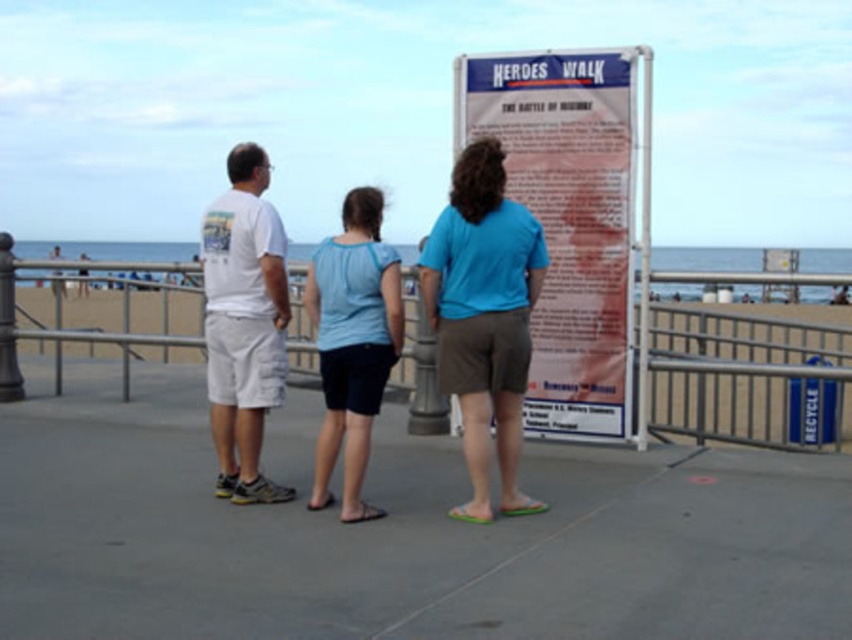
Does metallic gray railing at center appear on the right side of white cotton t-shirt at left?

No, metallic gray railing at center is not to the right of white cotton t-shirt at left.

Is metallic gray railing at center further to the viewer compared to white cotton t-shirt at left?

Yes.

Is point (153, 342) closer to viewer compared to point (251, 467)?

That is False.

Where is `metallic gray railing at center`? Image resolution: width=852 pixels, height=640 pixels. metallic gray railing at center is located at coordinates (747, 378).

Between point (593, 131) and point (338, 371), which one is positioned behind?

The point (593, 131) is behind.

Is point (619, 328) in front of point (505, 202)?

That is False.

Where is `white paper sign at center`? white paper sign at center is located at coordinates (567, 220).

Looking at this image, who is positioned more to the left, white cotton t-shirt at left or light blue fabric shirt at center?

Positioned to the left is white cotton t-shirt at left.

Between point (210, 394) and point (349, 218), which one is positioned in front?

Point (349, 218)

Find the location of a particular element. white cotton t-shirt at left is located at coordinates (245, 323).